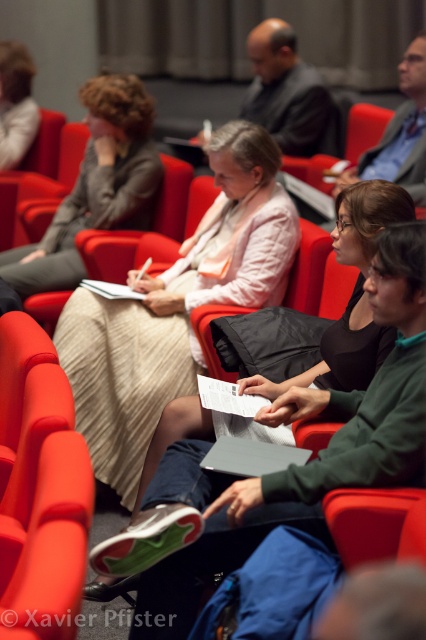
You are sitting in the back row of the lecture hall and want to ask a question to the speaker at the front. You notice the matte black jacket at center and the dark gray suit at upper center blocking your view. Which of these two is closer to you?

The matte black jacket at center is closer to you since it is in front of the dark gray suit at upper center.